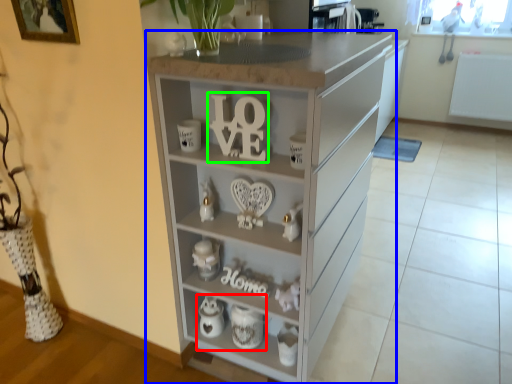
Question: Based on their relative distances, which object is farther from tea set (highlighted by a red box)? Choose from chest of drawers (highlighted by a blue box) and alphabet (highlighted by a green box).

Choices:
 (A) chest of drawers
 (B) alphabet

Answer: (B)